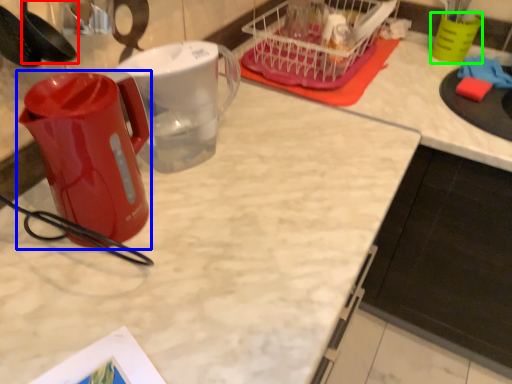
Question: Estimate the real-world distances between objects in this image. Which object is farther from spoon (highlighted by a red box), kettle (highlighted by a blue box) or coffee cup (highlighted by a green box)?

Choices:
 (A) kettle
 (B) coffee cup

Answer: (B)